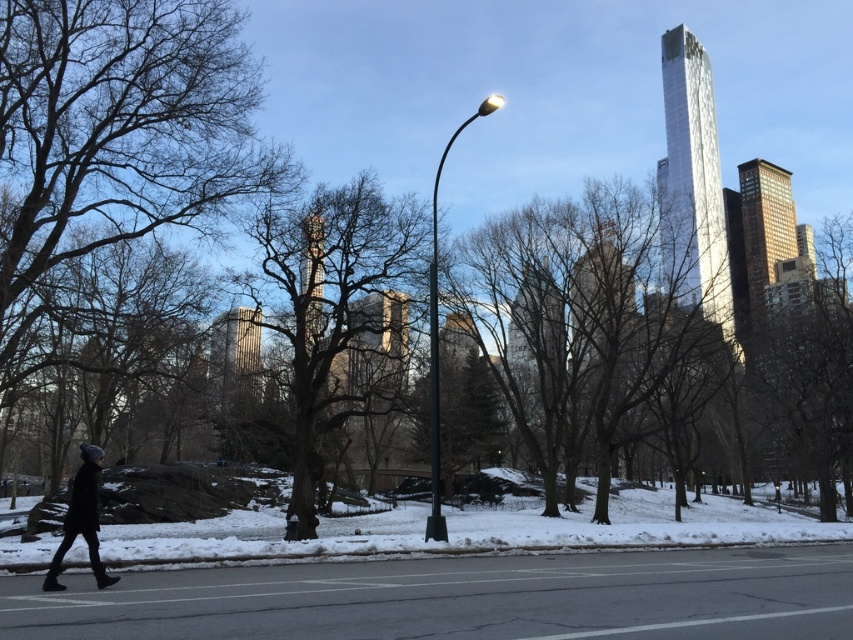
Question: Estimate the real-world distances between objects in this image. Which object is closer to the bare branches at left?

Choices:
 (A) brown textured tree at right
 (B) black woolen hat at lower left
 (C) smooth brown tree at center
 (D) bare branches at center

Answer: (D)

Question: Which point is farther to the camera?

Choices:
 (A) (808, 432)
 (B) (195, 76)
 (C) (86, 508)
 (D) (339, 276)

Answer: (A)

Question: Among these objects, which one is farthest from the camera?

Choices:
 (A) smooth brown tree at center
 (B) bare branches at left
 (C) black woolen hat at lower left
 (D) bare branches at center

Answer: (A)

Question: Can you confirm if bare branches at left is wider than bare branches at center?

Choices:
 (A) yes
 (B) no

Answer: (B)

Question: Is smooth brown tree at center below bare branches at center?

Choices:
 (A) no
 (B) yes

Answer: (B)

Question: Can you confirm if bare branches at left is thinner than smooth brown tree at center?

Choices:
 (A) yes
 (B) no

Answer: (A)